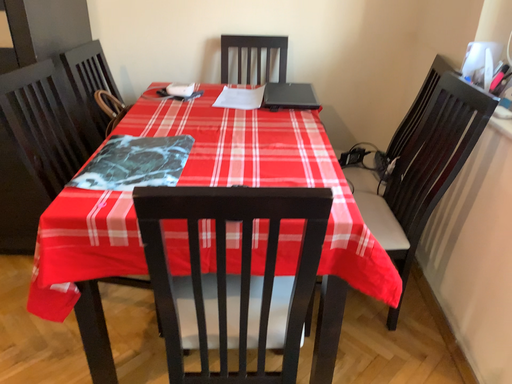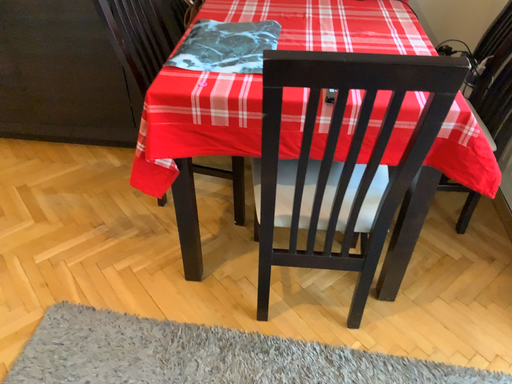
Question: How did the camera likely rotate when shooting the video?

Choices:
 (A) rotated downward
 (B) rotated upward

Answer: (A)